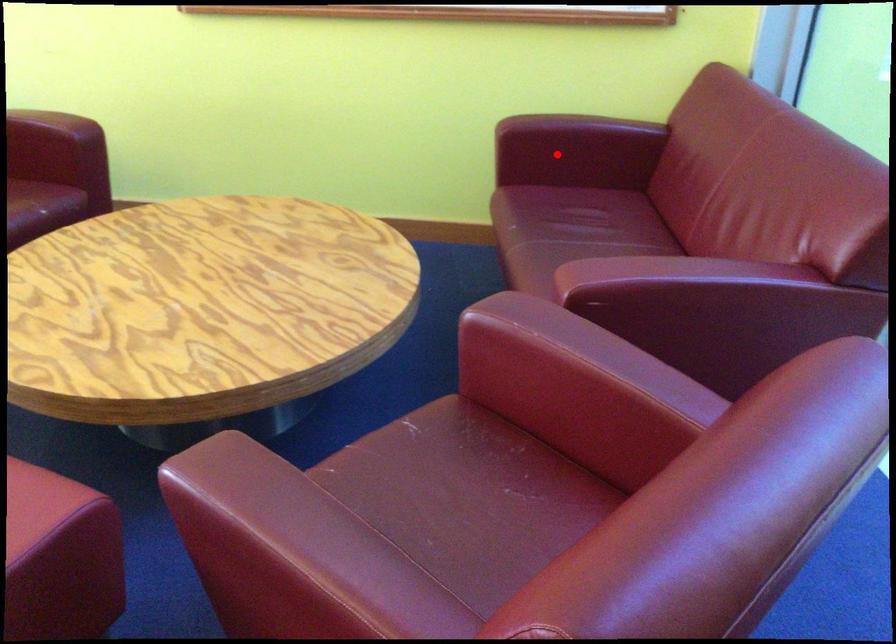
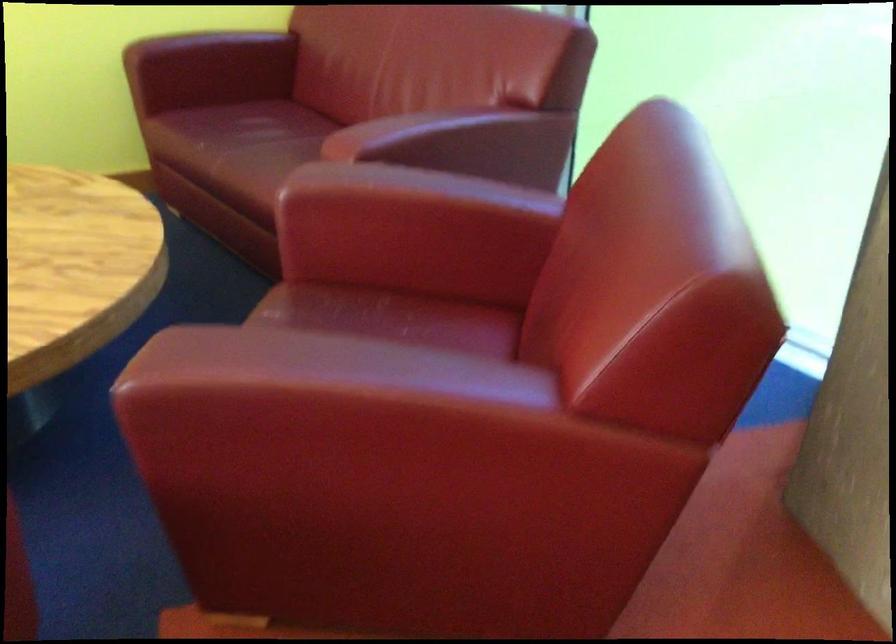
In the second image, find the point that corresponds to the highlighted location in the first image.

(208, 69)